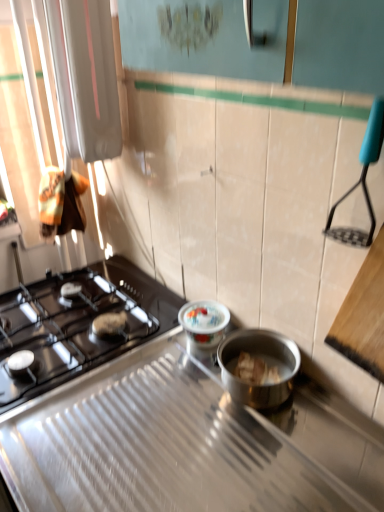
What do you see at coordinates (187, 443) in the screenshot? Image resolution: width=384 pixels, height=512 pixels. I see `black matte gas stove at left, which is counted as the 1th gas stove, starting from the front` at bounding box center [187, 443].

Locate an element on the screen. porcelain floral-patterned container at center is located at coordinates (204, 325).

Is point (213, 340) less distant than point (20, 399)?

No, it is not.

From a real-world perspective, who is located lower, porcelain floral-patterned container at center or black glass gas stove at left, the second gas stove from the front?

black glass gas stove at left, the second gas stove from the front, from a real-world perspective.

In the image, is porcelain floral-patterned container at center positioned in front of or behind black glass gas stove at left, the second gas stove from the front?

Visually, porcelain floral-patterned container at center is located behind black glass gas stove at left, the second gas stove from the front.

Based on the photo, considering the sizes of porcelain floral-patterned container at center and black matte gas stove at left, which is counted as the 1th gas stove, starting from the front, in the image, is porcelain floral-patterned container at center taller or shorter than black matte gas stove at left, which is counted as the 1th gas stove, starting from the front,?

porcelain floral-patterned container at center is taller than black matte gas stove at left, which is counted as the 1th gas stove, starting from the front.

Considering the sizes of objects porcelain floral-patterned container at center and black matte gas stove at left, which is counted as the 1th gas stove, starting from the front, in the image provided, who is thinner, porcelain floral-patterned container at center or black matte gas stove at left, which is counted as the 1th gas stove, starting from the front,?

With smaller width is porcelain floral-patterned container at center.

Is porcelain floral-patterned container at center inside the boundaries of black matte gas stove at left, which is counted as the 1th gas stove, starting from the front, or outside?

porcelain floral-patterned container at center is spatially situated outside black matte gas stove at left, which is counted as the 1th gas stove, starting from the front.

Can you tell me how much porcelain floral-patterned container at center and black matte gas stove at left, which is the second gas stove from back to front, differ in facing direction?

They differ by 0.00122 degrees in their facing directions.

Can you confirm if black glass gas stove at left, the second gas stove from the front, is wider than porcelain floral-patterned container at center?

Indeed, black glass gas stove at left, the second gas stove from the front, has a greater width compared to porcelain floral-patterned container at center.

How different are the orientations of black glass gas stove at left, placed as the 1th gas stove when sorted from back to front, and porcelain floral-patterned container at center in degrees?

The facing directions of black glass gas stove at left, placed as the 1th gas stove when sorted from back to front, and porcelain floral-patterned container at center are 0.00119 degrees apart.

Does black glass gas stove at left, placed as the 1th gas stove when sorted from back to front, lie in front of porcelain floral-patterned container at center?

Yes, black glass gas stove at left, placed as the 1th gas stove when sorted from back to front, is closer to the viewer.

Identify the location of the 2nd gas stove to the left of the porcelain floral-patterned container at center, starting your count from the anchor. The width and height of the screenshot is (384, 512). (79, 324).

The image size is (384, 512). I want to click on gas stove behind the black matte gas stove at left, which is counted as the 1th gas stove, starting from the front, so click(79, 324).

From a real-world perspective, does black matte gas stove at left, which is the second gas stove from back to front, stand above black glass gas stove at left, the second gas stove from the front?

Yes, from a real-world perspective, black matte gas stove at left, which is the second gas stove from back to front, is on top of black glass gas stove at left, the second gas stove from the front.

Looking at this image, between black matte gas stove at left, which is counted as the 1th gas stove, starting from the front, and black glass gas stove at left, placed as the 1th gas stove when sorted from back to front, which one has larger size?

black glass gas stove at left, placed as the 1th gas stove when sorted from back to front, is bigger.

Is black matte gas stove at left, which is the second gas stove from back to front, beside black glass gas stove at left, the second gas stove from the front?

No, black matte gas stove at left, which is the second gas stove from back to front, is not in contact with black glass gas stove at left, the second gas stove from the front.

In the image, is black glass gas stove at left, the second gas stove from the front, on the left side or the right side of black matte gas stove at left, which is the second gas stove from back to front?

black glass gas stove at left, the second gas stove from the front, is to the left of black matte gas stove at left, which is the second gas stove from back to front.

From the image's perspective, relative to black matte gas stove at left, which is counted as the 1th gas stove, starting from the front, is black glass gas stove at left, the second gas stove from the front, above or below?

Clearly, from the image's perspective, black glass gas stove at left, the second gas stove from the front, is above black matte gas stove at left, which is counted as the 1th gas stove, starting from the front.

How distant is black glass gas stove at left, placed as the 1th gas stove when sorted from back to front, from black matte gas stove at left, which is counted as the 1th gas stove, starting from the front?

black glass gas stove at left, placed as the 1th gas stove when sorted from back to front, is 6.43 inches from black matte gas stove at left, which is counted as the 1th gas stove, starting from the front.

Between point (43, 342) and point (313, 420), which one is positioned behind?

The point (43, 342) is farther.

Visually, is black matte gas stove at left, which is the second gas stove from back to front, positioned to the left or to the right of porcelain floral-patterned container at center?

In the image, black matte gas stove at left, which is the second gas stove from back to front, appears on the left side of porcelain floral-patterned container at center.

From the image's perspective, is black matte gas stove at left, which is counted as the 1th gas stove, starting from the front, on top of porcelain floral-patterned container at center?

No, from the image's perspective, black matte gas stove at left, which is counted as the 1th gas stove, starting from the front, is not on top of porcelain floral-patterned container at center.

From the picture: Which of these two, black matte gas stove at left, which is counted as the 1th gas stove, starting from the front, or porcelain floral-patterned container at center, is thinner?

A: porcelain floral-patterned container at center.

This screenshot has height=512, width=384. What are the coordinates of `the 2nd gas stove in front of the porcelain floral-patterned container at center, starting your count from the anchor` in the screenshot? It's located at (187, 443).

Image resolution: width=384 pixels, height=512 pixels. Identify the location of appliance lying on the right of black glass gas stove at left, placed as the 1th gas stove when sorted from back to front. (204, 325).

At what (x,y) coordinates should I click in order to perform the action: click on the 2nd gas stove in front of the porcelain floral-patterned container at center, counting from the anchor's position. Please return your answer as a coordinate pair (x, y). Image resolution: width=384 pixels, height=512 pixels. Looking at the image, I should click on (187, 443).

Based on their spatial positions, is black matte gas stove at left, which is counted as the 1th gas stove, starting from the front, or porcelain floral-patterned container at center further from black glass gas stove at left, the second gas stove from the front?

porcelain floral-patterned container at center lies further to black glass gas stove at left, the second gas stove from the front, than the other object.

When comparing their distances from porcelain floral-patterned container at center, does black glass gas stove at left, the second gas stove from the front, or black matte gas stove at left, which is counted as the 1th gas stove, starting from the front, seem closer?

black matte gas stove at left, which is counted as the 1th gas stove, starting from the front, is closer to porcelain floral-patterned container at center.

Which object lies nearer to the anchor point black glass gas stove at left, the second gas stove from the front, porcelain floral-patterned container at center or black matte gas stove at left, which is counted as the 1th gas stove, starting from the front?

Based on the image, black matte gas stove at left, which is counted as the 1th gas stove, starting from the front, appears to be nearer to black glass gas stove at left, the second gas stove from the front.

From the image, which object appears to be farther from black matte gas stove at left, which is the second gas stove from back to front, black glass gas stove at left, the second gas stove from the front, or porcelain floral-patterned container at center?

The object further to black matte gas stove at left, which is the second gas stove from back to front, is porcelain floral-patterned container at center.

From the image, which object appears to be farther from black matte gas stove at left, which is counted as the 1th gas stove, starting from the front, porcelain floral-patterned container at center or black glass gas stove at left, the second gas stove from the front?

porcelain floral-patterned container at center lies further to black matte gas stove at left, which is counted as the 1th gas stove, starting from the front, than the other object.

Which object lies nearer to the anchor point porcelain floral-patterned container at center, black matte gas stove at left, which is counted as the 1th gas stove, starting from the front, or black glass gas stove at left, the second gas stove from the front?

black matte gas stove at left, which is counted as the 1th gas stove, starting from the front.

The height and width of the screenshot is (512, 384). I want to click on gas stove between black matte gas stove at left, which is the second gas stove from back to front, and porcelain floral-patterned container at center from front to back, so click(x=79, y=324).